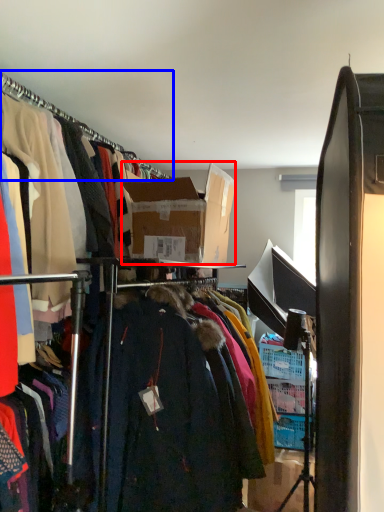
Question: Which point is closer to the camera, box (highlighted by a red box) or hanger (highlighted by a blue box)?

Choices:
 (A) box
 (B) hanger

Answer: (B)